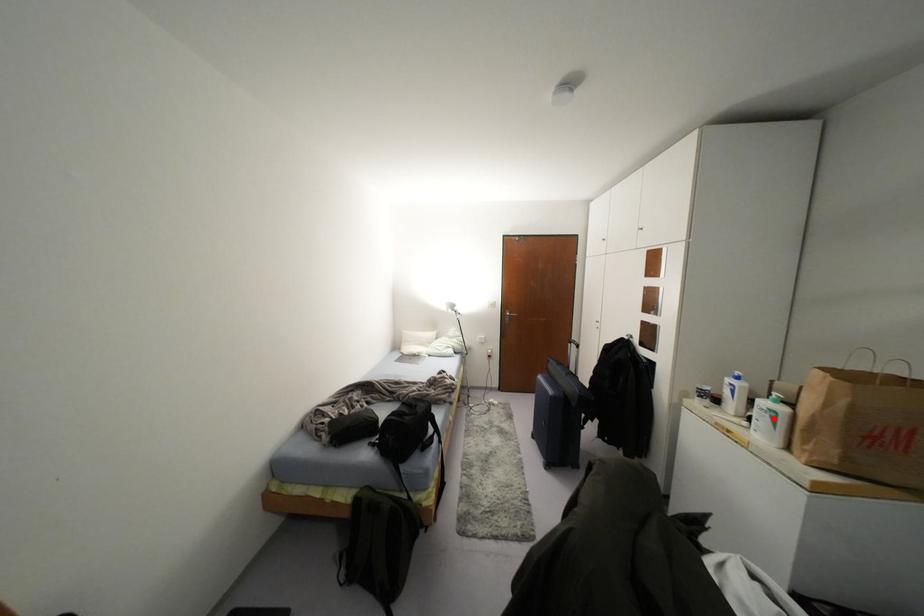
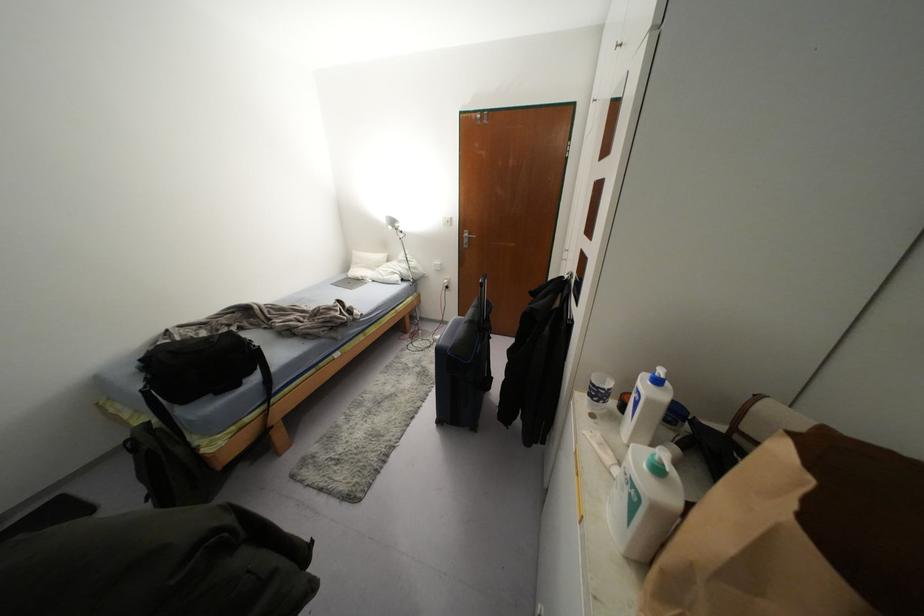
Where in the second image is the point corresponding to the highlighted location from the first image?

(633, 505)